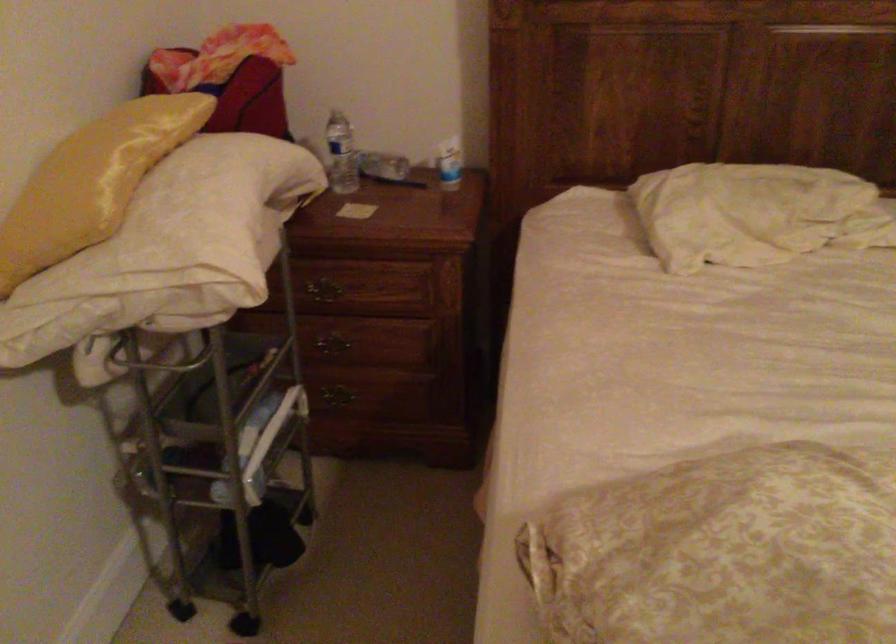
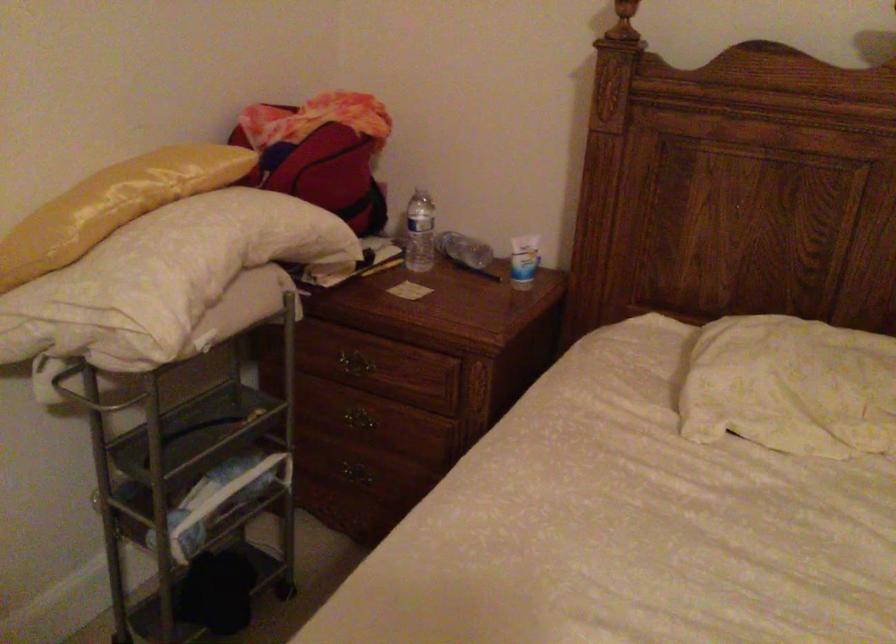
Question: The camera is either moving clockwise (left) or counter-clockwise (right) around the object. The first image is from the beginning of the video and the second image is from the end. Is the camera moving left or right when shooting the video?

Choices:
 (A) Left
 (B) Right

Answer: (B)